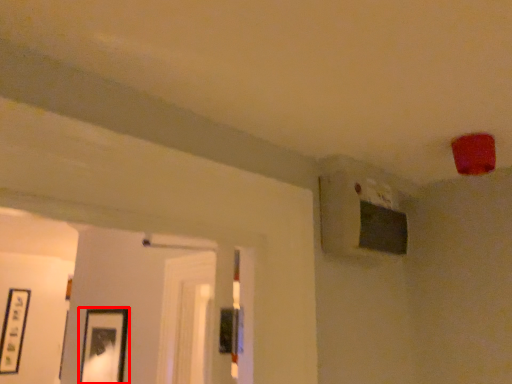
Question: From the image's perspective, where is picture frame (annotated by the red box) located relative to picture frame?

Choices:
 (A) below
 (B) above

Answer: (B)